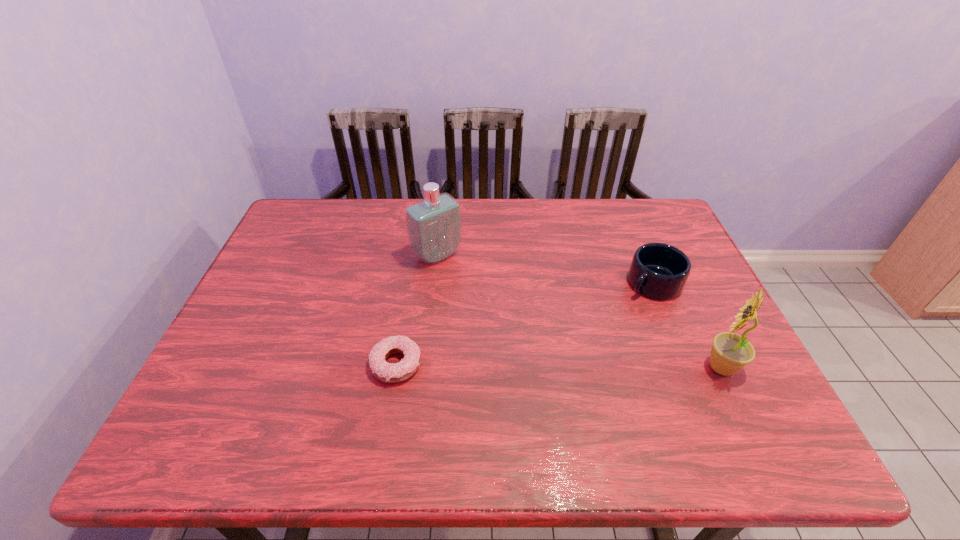
Where is `vacant space on the desktop that is between the shortest object and the sunflower and is positioned with the handle on the side of the mug`? vacant space on the desktop that is between the shortest object and the sunflower and is positioned with the handle on the side of the mug is located at coordinates (548, 366).

Locate an element on the screen. free space on the desktop that is between the doughnut and the sunflower and is positioned on the front label of the perfume is located at coordinates (544, 366).